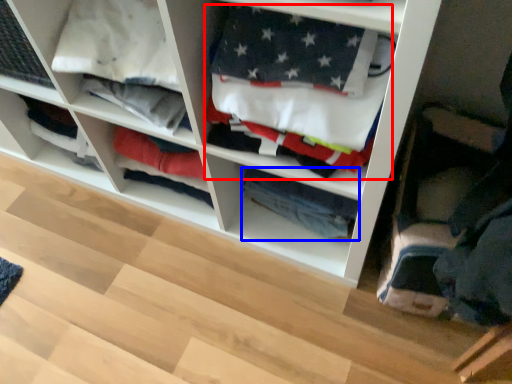
Question: Which point is further to the camera, clothing (highlighted by a red box) or clothing (highlighted by a blue box)?

Choices:
 (A) clothing
 (B) clothing

Answer: (B)